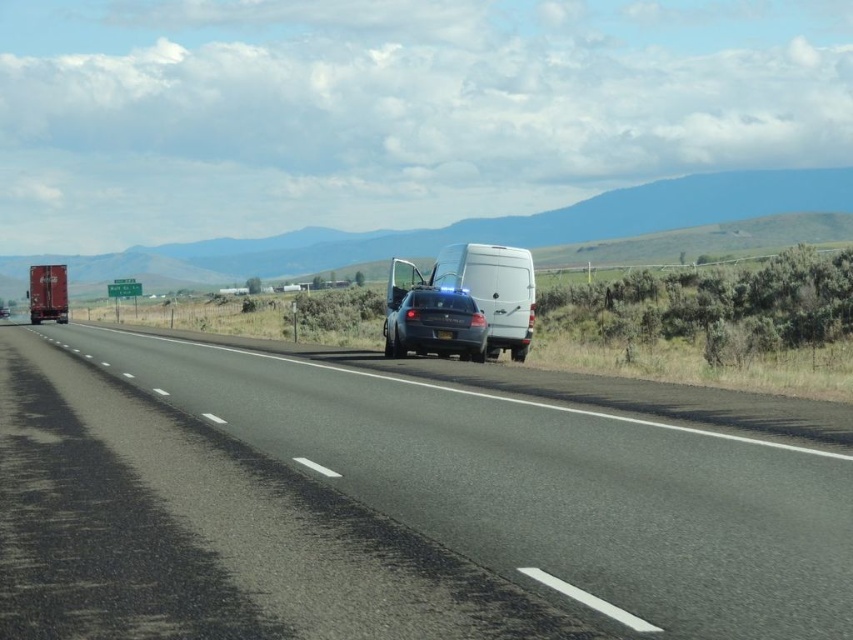
Question: Which of the following is the closest to the observer?

Choices:
 (A) black asphalt road at center
 (B) metallic red trailer truck at left

Answer: (A)

Question: Which point is farther to the camera?

Choices:
 (A) (44, 307)
 (B) (527, 291)
 (C) (376, 625)
 (D) (474, 308)

Answer: (A)

Question: Is white matte van at center thinner than satin black sedan at center?

Choices:
 (A) yes
 (B) no

Answer: (B)

Question: Can you confirm if black asphalt road at center is wider than white matte van at center?

Choices:
 (A) no
 (B) yes

Answer: (B)

Question: Among these objects, which one is farthest from the camera?

Choices:
 (A) metallic red trailer truck at left
 (B) satin black sedan at center
 (C) black asphalt road at center
 (D) white matte van at center

Answer: (A)

Question: Is black asphalt road at center to the right of satin black sedan at center from the viewer's perspective?

Choices:
 (A) no
 (B) yes

Answer: (A)